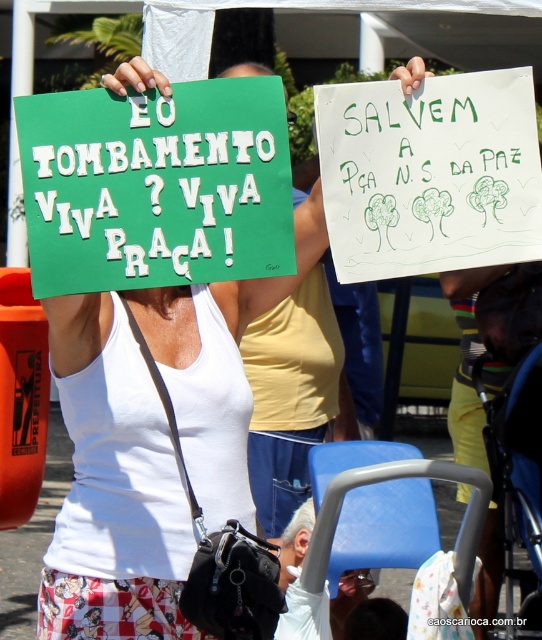
Question: Among these points, which one is nearest to the camera?

Choices:
 (A) (76, 630)
 (B) (170, 132)
 (C) (391, 252)

Answer: (B)

Question: Where is white paper sign at upper center located in relation to gray hair at center in the image?

Choices:
 (A) above
 (B) below

Answer: (A)

Question: Can you confirm if white fabric tank top at center is positioned to the right of dark brown hair at center?

Choices:
 (A) no
 (B) yes

Answer: (A)

Question: Which of the following is the closest to the observer?

Choices:
 (A) dark brown hair at center
 (B) white fabric tank top at center

Answer: (B)

Question: Is green paper sign at center to the right of white paper sign at upper center from the viewer's perspective?

Choices:
 (A) yes
 (B) no

Answer: (B)

Question: Which of the following is the closest to the observer?

Choices:
 (A) gray hair at center
 (B) white fabric tank top at center
 (C) green paper sign at center
 (D) dark brown hair at center

Answer: (C)